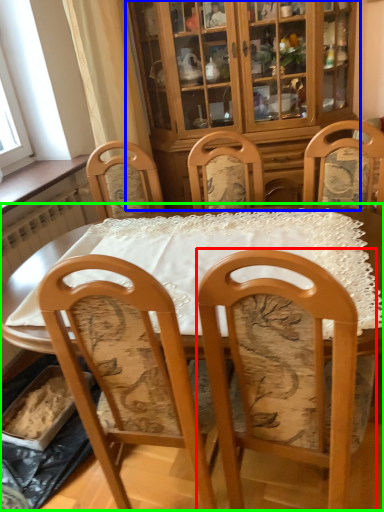
Question: Which object is the farthest from chair (highlighted by a red box)? Choose among these: cabinetry (highlighted by a blue box) or table (highlighted by a green box).

Choices:
 (A) cabinetry
 (B) table

Answer: (A)